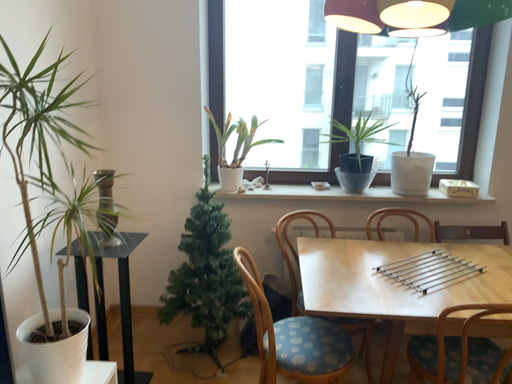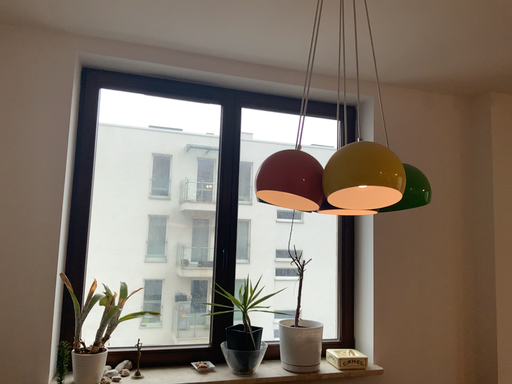
Question: Which way did the camera rotate in the video?

Choices:
 (A) rotated right
 (B) rotated left

Answer: (A)